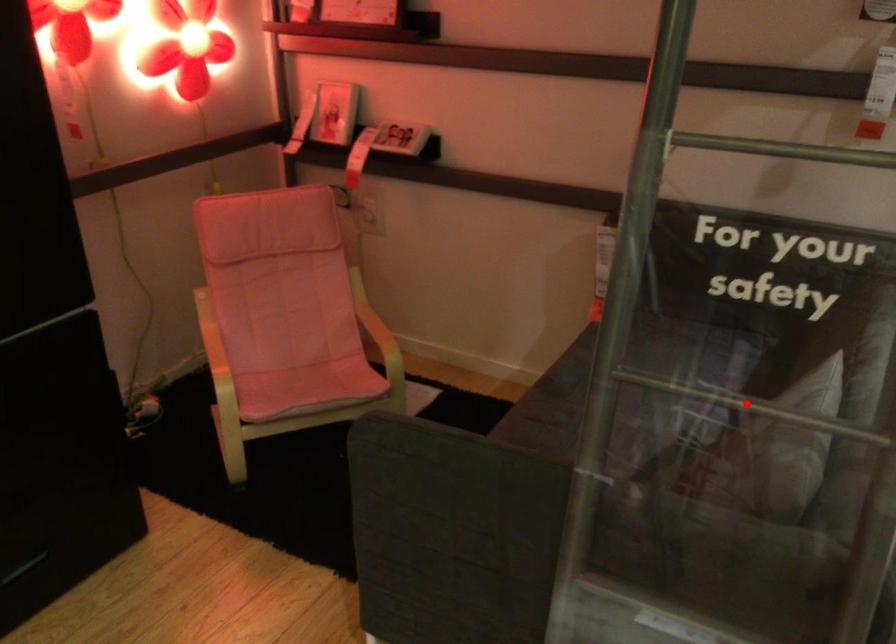
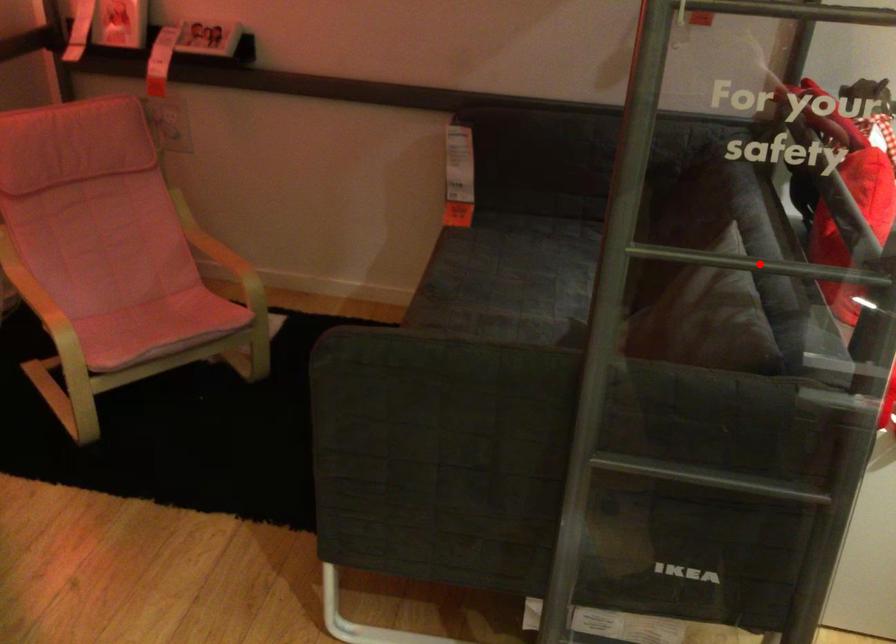
I am providing you with two images of the same scene from different viewpoints. A red point is marked on the first image and another point is marked on the second image. Are the points marked in image1 and image2 representing the same 3D position?

Yes